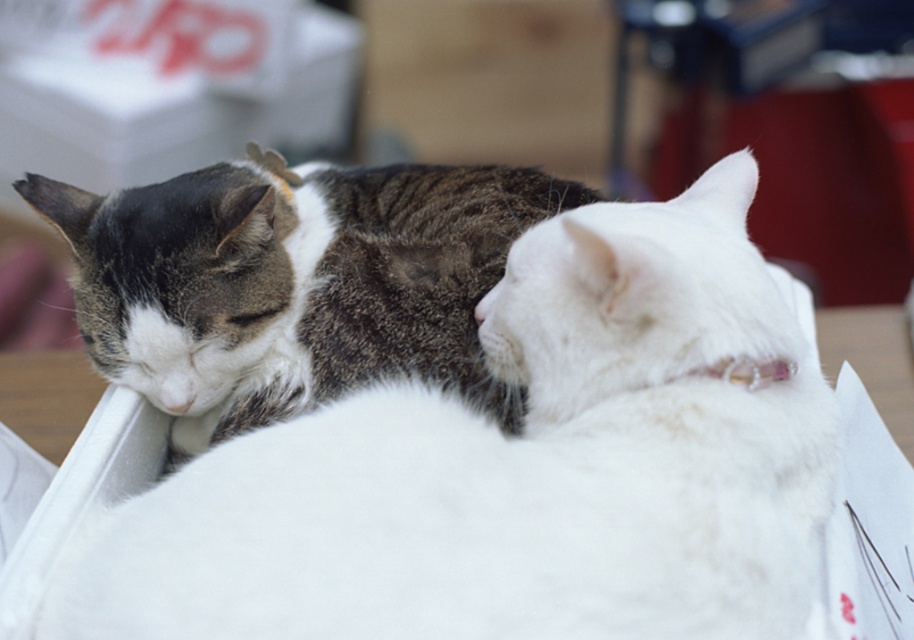
You are a cat owner who wants to place a small toy between the two cats. Based on their positions, where should you place the toy so it is equidistant from both the white fluffy cat at center and the tabby fur cat at left?

The white fluffy cat at center is to the right of the tabby fur cat at left, so placing the toy exactly halfway between them would ensure it is equidistant from both cats.

You are a veterinarian examining two cats in a cardboard box. The white fluffy cat at center and the tabby fur cat at left are both asleep. Based on their sizes, which cat might require a larger sleeping area?

The white fluffy cat at center is larger in size than the tabby fur cat at left, so it would need a larger sleeping area.